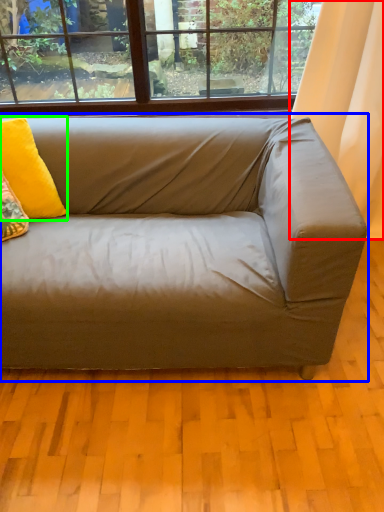
Question: Considering the real-world distances, which object is farthest from curtain (highlighted by a red box)? studio couch (highlighted by a blue box) or pillow (highlighted by a green box)?

Choices:
 (A) studio couch
 (B) pillow

Answer: (B)